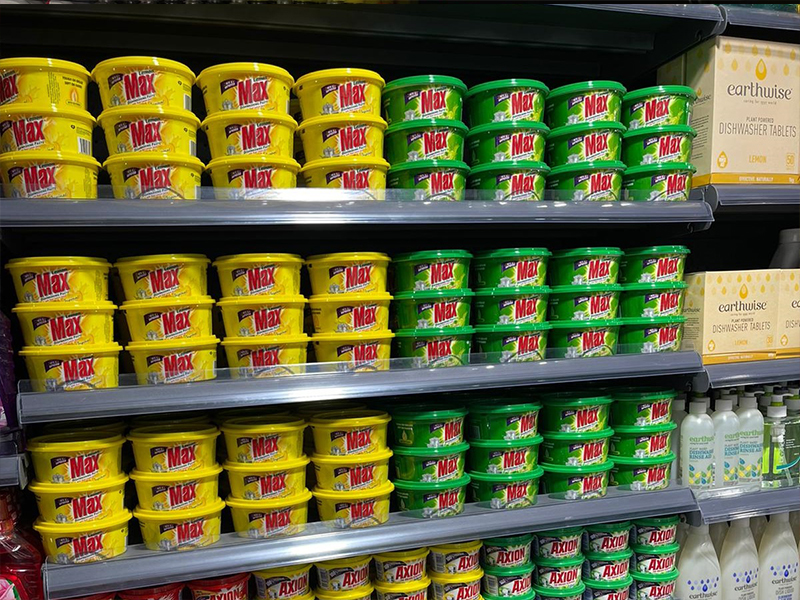
Find the location of a particular element. dishwasher tablets is located at coordinates (774, 300), (764, 94).